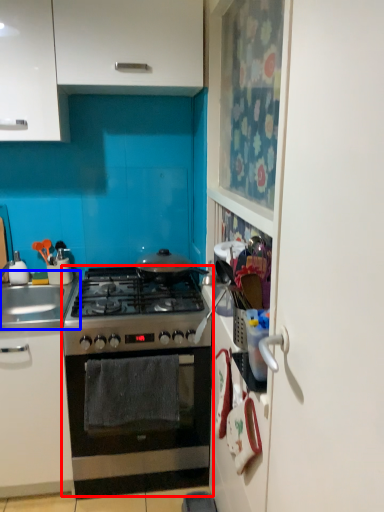
Question: Which of the following is the closest to the observer, oven (highlighted by a red box) or sink (highlighted by a blue box)?

Choices:
 (A) oven
 (B) sink

Answer: (A)